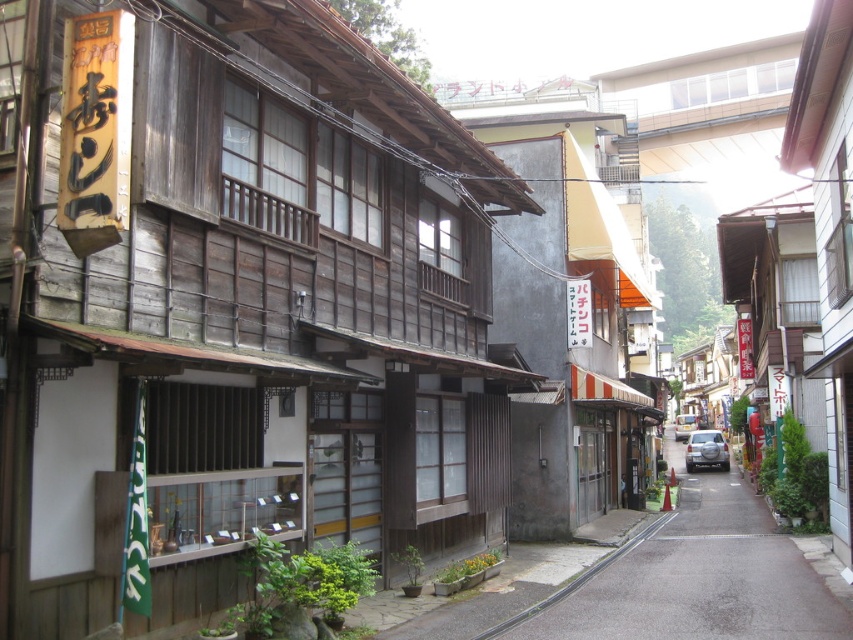
Question: Which point is farther to the camera?

Choices:
 (A) (718, 449)
 (B) (676, 422)

Answer: (B)

Question: Which is nearer to the smooth concrete pavement at center?

Choices:
 (A) metallic silver car at center
 (B) silver metallic car at center

Answer: (B)

Question: Is smooth concrete pavement at center smaller than metallic silver car at center?

Choices:
 (A) no
 (B) yes

Answer: (A)

Question: Is silver metallic car at center positioned in front of metallic silver car at center?

Choices:
 (A) no
 (B) yes

Answer: (B)

Question: Is smooth concrete pavement at center to the left of silver metallic car at center from the viewer's perspective?

Choices:
 (A) no
 (B) yes

Answer: (B)

Question: Which point appears closest to the camera in this image?

Choices:
 (A) (679, 433)
 (B) (689, 493)

Answer: (B)